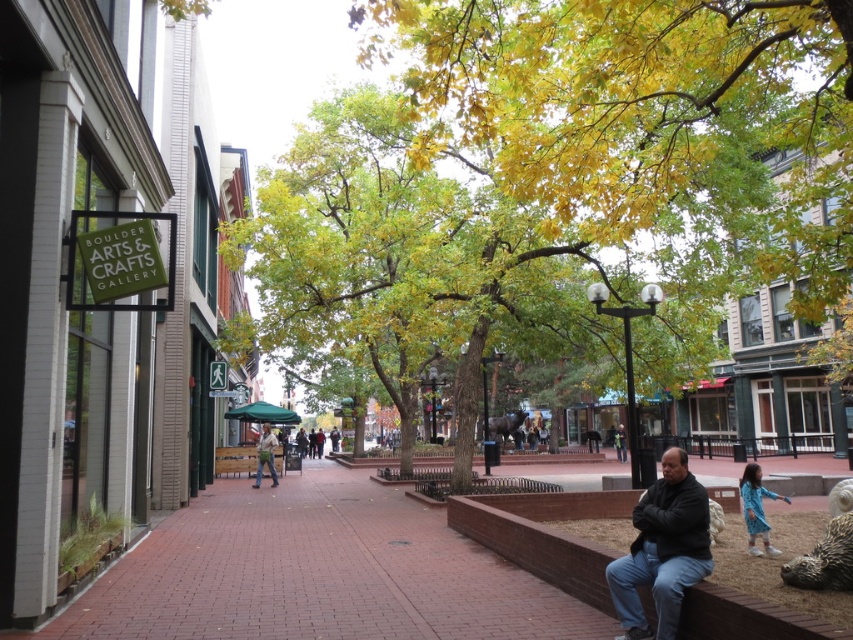
Which is in front, point (595, 497) or point (753, 474)?

Point (753, 474) is more forward.

Can you confirm if brick ledge at lower right is positioned to the right of blue cotton dress at lower right?

Incorrect, brick ledge at lower right is not on the right side of blue cotton dress at lower right.

This screenshot has width=853, height=640. Describe the element at coordinates (544, 536) in the screenshot. I see `brick ledge at lower right` at that location.

You are a GUI agent. You are given a task and a screenshot of the screen. Output one action in this format:
    pyautogui.click(x=<x>, y=<y>)
    Task: Click on the brick ledge at lower right
    The image size is (853, 640).
    Given the screenshot: What is the action you would take?
    pyautogui.click(x=544, y=536)

Is point (633, 502) closer to viewer compared to point (260, 467)?

Yes, it is.

Between brick ledge at lower right and khaki cotton shirt at center, which one is positioned lower?

khaki cotton shirt at center is below.

What do you see at coordinates (544, 536) in the screenshot? Image resolution: width=853 pixels, height=640 pixels. I see `brick ledge at lower right` at bounding box center [544, 536].

The image size is (853, 640). Identify the location of brick ledge at lower right. (544, 536).

Between dark gray jacket at lower right and khaki cotton shirt at center, which one is positioned lower?

Positioned lower is khaki cotton shirt at center.

Does dark gray jacket at lower right have a larger size compared to khaki cotton shirt at center?

No, dark gray jacket at lower right is not bigger than khaki cotton shirt at center.

The height and width of the screenshot is (640, 853). Describe the element at coordinates (662, 550) in the screenshot. I see `dark gray jacket at lower right` at that location.

Locate an element on the screen. Image resolution: width=853 pixels, height=640 pixels. dark gray jacket at lower right is located at coordinates (662, 550).